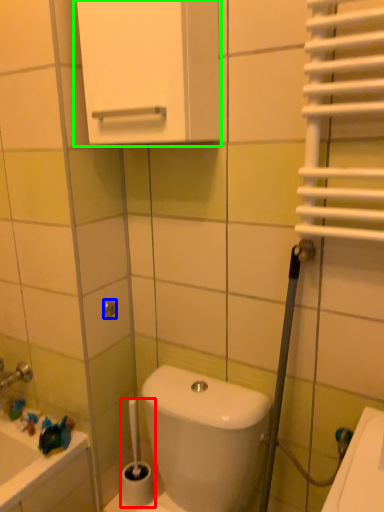
Question: Which is nearer to the brush (highlighted by a red box)? shower (highlighted by a blue box) or medicine cabinet (highlighted by a green box).

Choices:
 (A) shower
 (B) medicine cabinet

Answer: (A)